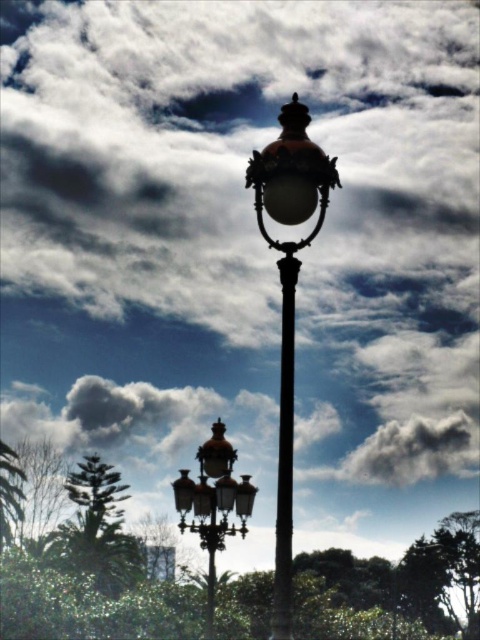
Question: Estimate the real-world distances between objects in this image. Which object is closer to the green leafy tree at lower left?

Choices:
 (A) black polished pole at center
 (B) polished brass street light at center
 (C) polished brass lamp post at center
 (D) glossy brass streetlight at upper center

Answer: (A)

Question: Among these objects, which one is nearest to the camera?

Choices:
 (A) glossy brass streetlight at upper center
 (B) polished brass street light at center
 (C) polished brass lamp post at center

Answer: (C)

Question: Considering the relative positions of polished brass lamp post at center and polished brass street light at center in the image provided, where is polished brass lamp post at center located with respect to polished brass street light at center?

Choices:
 (A) left
 (B) right

Answer: (B)

Question: Can you confirm if green leafy tree at lower left is positioned to the right of polished brass street light at center?

Choices:
 (A) no
 (B) yes

Answer: (A)

Question: Is polished brass lamp post at center to the left of glossy brass streetlight at upper center from the viewer's perspective?

Choices:
 (A) no
 (B) yes

Answer: (B)

Question: Among these objects, which one is farthest from the camera?

Choices:
 (A) polished brass lamp post at center
 (B) glossy brass streetlight at upper center

Answer: (B)